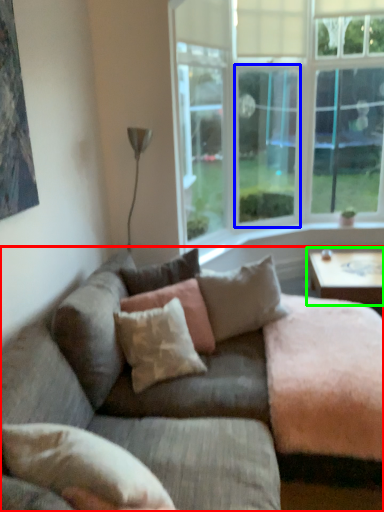
Question: Estimate the real-world distances between objects in this image. Which object is farther from studio couch (highlighted by a red box), window screen (highlighted by a blue box) or coffee table (highlighted by a green box)?

Choices:
 (A) window screen
 (B) coffee table

Answer: (A)